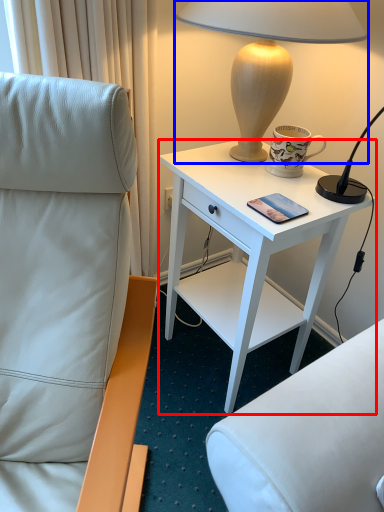
Question: Which object is further to the camera taking this photo, desk (highlighted by a red box) or lamp (highlighted by a blue box)?

Choices:
 (A) desk
 (B) lamp

Answer: (A)